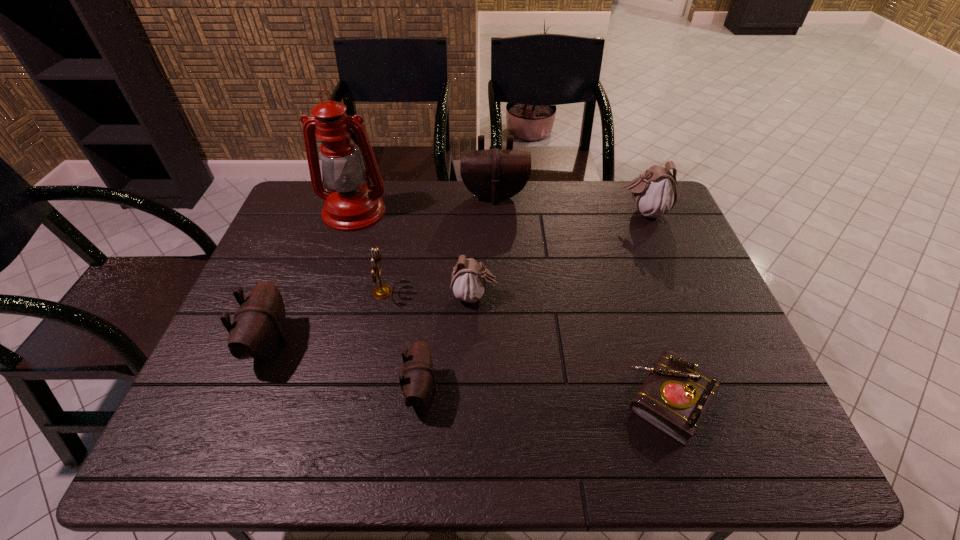
Where is `empty space that is in between the diary and the rightmost brown pouch`? empty space that is in between the diary and the rightmost brown pouch is located at coordinates (583, 298).

This screenshot has height=540, width=960. What are the coordinates of `vacant area that lies between the rightmost brown pouch and the leftmost brown pouch` in the screenshot? It's located at (382, 270).

I want to click on free point between the oil lamp and the farthest brown pouch, so click(424, 204).

This screenshot has width=960, height=540. I want to click on free point between the oil lamp and the leftmost brown pouch, so click(312, 278).

At what (x,y) coordinates should I click in order to perform the action: click on free space between the second biggest brown pouch and the biggest brown pouch. Please return your answer as a coordinate pair (x, y). Looking at the image, I should click on (382, 270).

Identify the location of vacant space that's between the rightmost brown pouch and the third object from left to right. (439, 244).

Locate an element on the screen. Image resolution: width=960 pixels, height=540 pixels. object that is the fourth nearest to the leftmost pouch is located at coordinates (469, 280).

This screenshot has height=540, width=960. Find the location of `object that stands as the closest to the tallest object`. object that stands as the closest to the tallest object is located at coordinates (383, 291).

Identify which pouch is the second nearest to the biggest brown pouch. Please provide its 2D coordinates. Your answer should be formatted as a tuple, i.e. [(x, y)], where the tuple contains the x and y coordinates of a point satisfying the conditions above.

[(469, 280)]

Select which pouch is the fourth closest to the leftmost pouch. Please provide its 2D coordinates. Your answer should be formatted as a tuple, i.e. [(x, y)], where the tuple contains the x and y coordinates of a point satisfying the conditions above.

[(655, 192)]